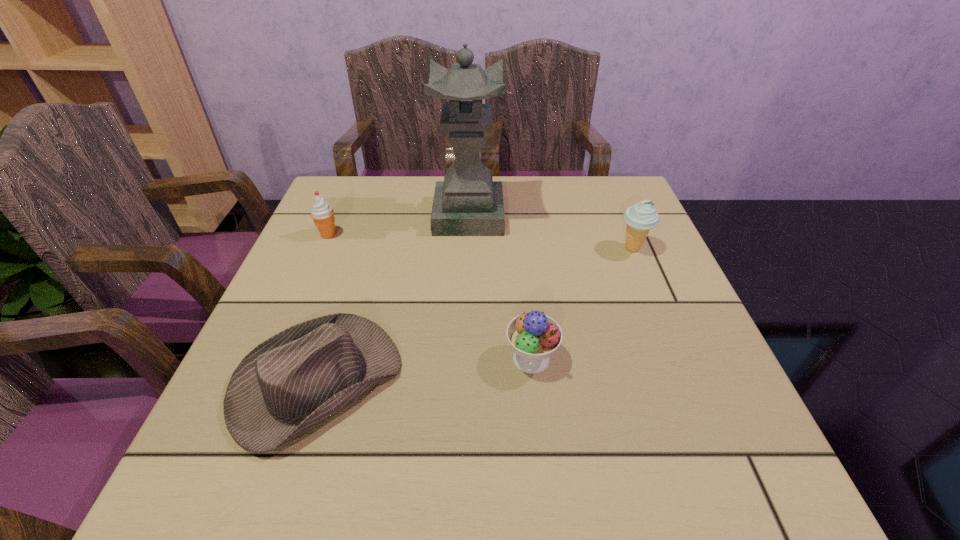
In the image, there is a desktop. Identify the location of vacant space at the far right corner. The width and height of the screenshot is (960, 540). (600, 207).

I want to click on free spot at the near right corner of the desktop, so click(x=693, y=477).

You are a GUI agent. You are given a task and a screenshot of the screen. Output one action in this format:
    pyautogui.click(x=<x>, y=<y>)
    Task: Click on the vacant region between the fedora and the leftmost icecream
    This screenshot has height=540, width=960.
    Given the screenshot: What is the action you would take?
    pyautogui.click(x=323, y=308)

Where is `free space between the leftmost icecream and the fedora`? The width and height of the screenshot is (960, 540). free space between the leftmost icecream and the fedora is located at coordinates (323, 308).

You are a GUI agent. You are given a task and a screenshot of the screen. Output one action in this format:
    pyautogui.click(x=<x>, y=<y>)
    Task: Click on the empty location between the tallest object and the rightmost icecream
    The width and height of the screenshot is (960, 540).
    Given the screenshot: What is the action you would take?
    pyautogui.click(x=551, y=232)

The image size is (960, 540). Find the location of `vacant region between the sculpture and the rightmost icecream`. vacant region between the sculpture and the rightmost icecream is located at coordinates click(x=551, y=232).

This screenshot has height=540, width=960. In order to click on vacant space in between the second icecream from right to left and the sculpture in this screenshot , I will do `click(500, 287)`.

Locate an element on the screen. vacant area that lies between the rightmost icecream and the fedora is located at coordinates (474, 315).

Identify the location of empty space between the leftmost icecream and the rightmost icecream. (481, 241).

Image resolution: width=960 pixels, height=540 pixels. Identify the location of free space between the second icecream from right to left and the sculpture. (500, 287).